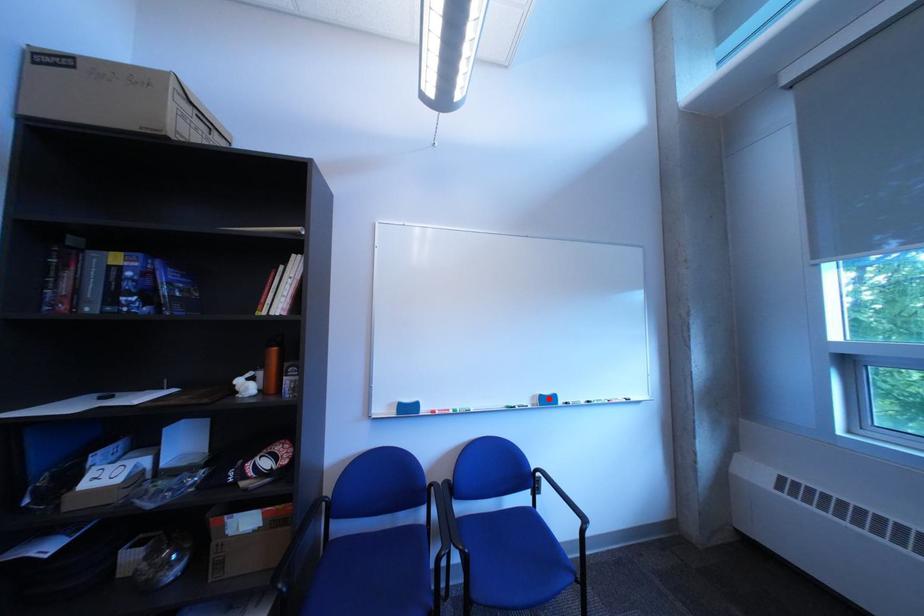
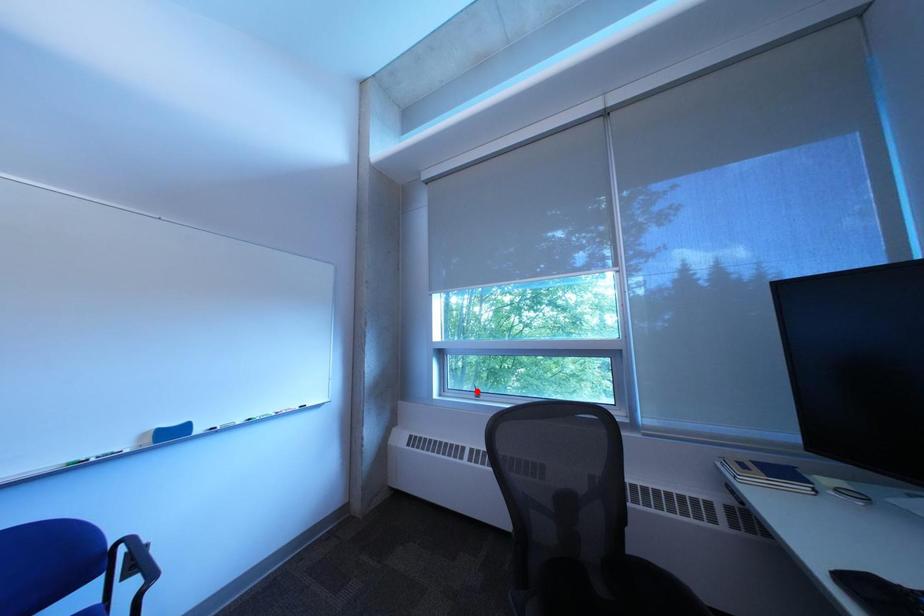
I am providing you with two images of the same scene from different viewpoints. A red point is marked on the first image and another point is marked on the second image. Do the highlighted points in image1 and image2 indicate the same real-world spot?

No